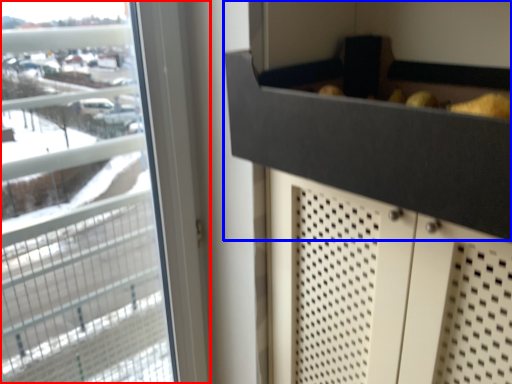
Question: Among these objects, which one is nearest to the camera, window (highlighted by a red box) or drawer (highlighted by a blue box)?

Choices:
 (A) window
 (B) drawer

Answer: (B)